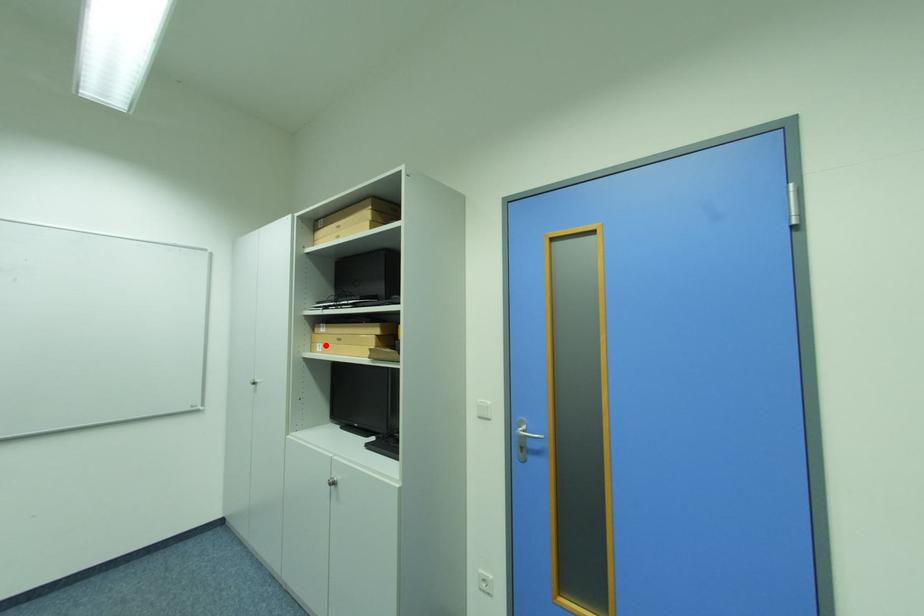
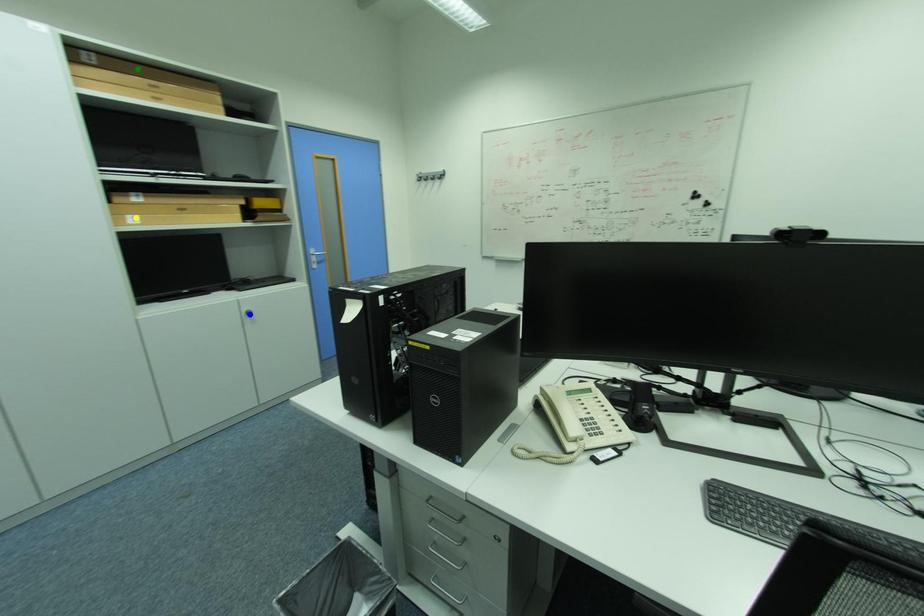
Question: I am providing you with two images of the same scene from different viewpoints. A red point is marked on the first image. You are given multiple points on the second image. Can you choose the point in image 2 that corresponds to the point in image 1?

Choices:
 (A) yellow point
 (B) blue point
 (C) green point

Answer: (A)